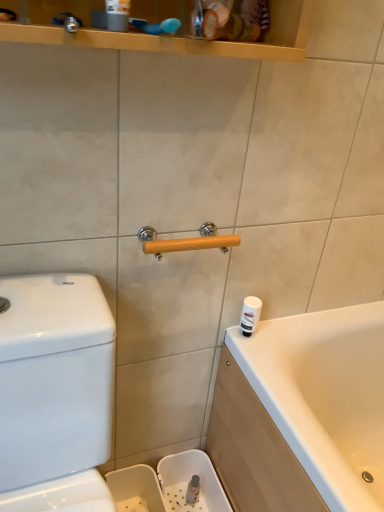
Question: Could you tell me if white glossy water tank at left is turned towards white plastic container at right?

Choices:
 (A) no
 (B) yes

Answer: (A)

Question: Is white glossy water tank at left further to the viewer compared to white plastic container at right?

Choices:
 (A) no
 (B) yes

Answer: (A)

Question: From a real-world perspective, is white glossy water tank at left located higher than white plastic container at right?

Choices:
 (A) no
 (B) yes

Answer: (A)

Question: Does white glossy water tank at left have a smaller size compared to white plastic container at right?

Choices:
 (A) yes
 (B) no

Answer: (B)

Question: Is white glossy water tank at left closer to the viewer compared to white plastic container at right?

Choices:
 (A) no
 (B) yes

Answer: (B)

Question: Is white glossy water tank at left at the left side of white plastic container at right?

Choices:
 (A) yes
 (B) no

Answer: (A)

Question: From the image's perspective, would you say wooden at center is shown under white glossy water tank at left?

Choices:
 (A) no
 (B) yes

Answer: (A)

Question: Is wooden at center to the left of white glossy water tank at left from the viewer's perspective?

Choices:
 (A) yes
 (B) no

Answer: (B)

Question: Is wooden at center completely or partially outside of white glossy water tank at left?

Choices:
 (A) no
 (B) yes

Answer: (B)

Question: From a real-world perspective, is wooden at center physically below white glossy water tank at left?

Choices:
 (A) yes
 (B) no

Answer: (B)

Question: From a real-world perspective, is wooden at center positioned over white glossy water tank at left based on gravity?

Choices:
 (A) yes
 (B) no

Answer: (A)

Question: Is wooden at center positioned with its back to white glossy water tank at left?

Choices:
 (A) no
 (B) yes

Answer: (A)

Question: Does white plastic container at right have a smaller size compared to wooden at center?

Choices:
 (A) no
 (B) yes

Answer: (B)